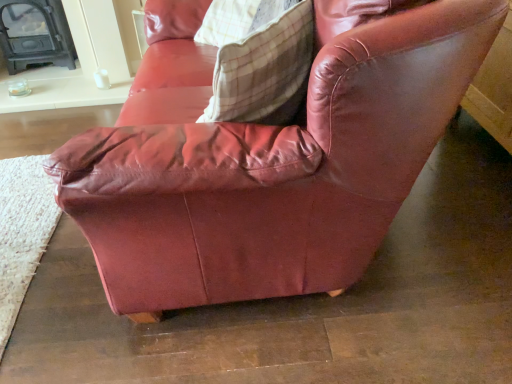
Question: Is point (257, 36) closer or farther from the camera than point (16, 52)?

Choices:
 (A) closer
 (B) farther

Answer: (A)

Question: Choose the correct answer: Is plaid fabric pillow at upper center inside matte black fireplace at left or outside it?

Choices:
 (A) inside
 (B) outside

Answer: (B)

Question: From a real-world perspective, is plaid fabric pillow at upper center above or below matte black fireplace at left?

Choices:
 (A) below
 (B) above

Answer: (B)

Question: Considering the positions of matte black fireplace at left and plaid fabric pillow at upper center in the image, is matte black fireplace at left taller or shorter than plaid fabric pillow at upper center?

Choices:
 (A) short
 (B) tall

Answer: (B)

Question: Is point (14, 72) positioned closer to the camera than point (237, 44)?

Choices:
 (A) farther
 (B) closer

Answer: (A)

Question: Considering their positions, is matte black fireplace at left located in front of or behind plaid fabric pillow at upper center?

Choices:
 (A) behind
 (B) front

Answer: (A)

Question: From the image's perspective, is matte black fireplace at left positioned above or below plaid fabric pillow at upper center?

Choices:
 (A) below
 (B) above

Answer: (B)